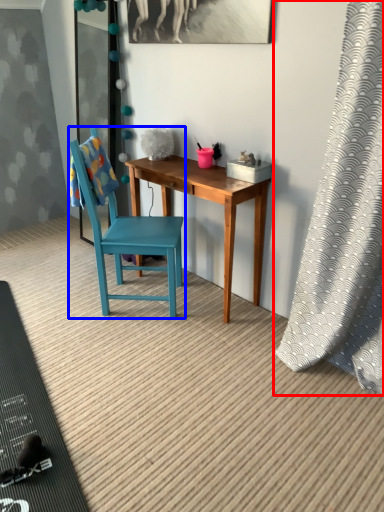
Question: Which object is closer to the camera taking this photo, curtain (highlighted by a red box) or chair (highlighted by a blue box)?

Choices:
 (A) curtain
 (B) chair

Answer: (A)